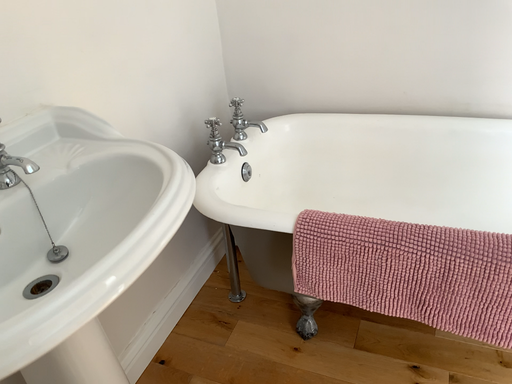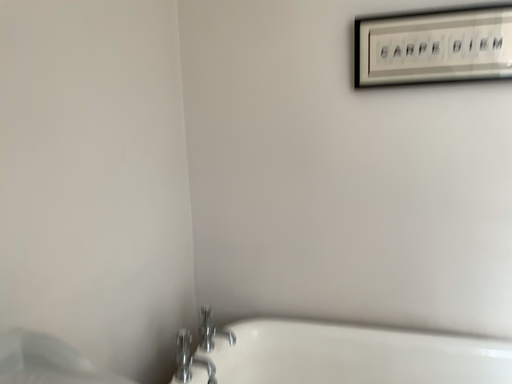
Question: Which way did the camera rotate in the video?

Choices:
 (A) rotated left
 (B) rotated right

Answer: (B)